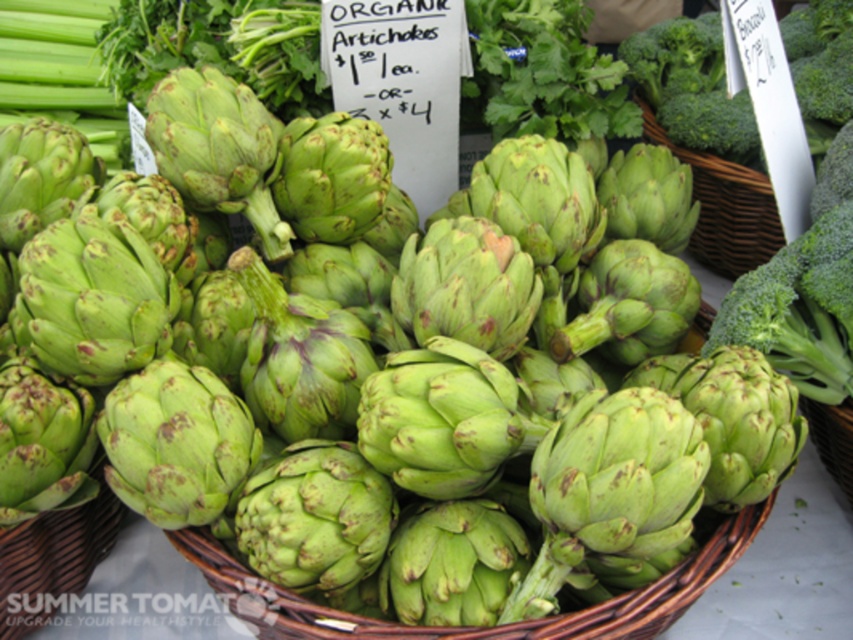
Question: Can you confirm if green wicker basket at center is positioned above woven brown basket at right?

Choices:
 (A) yes
 (B) no

Answer: (B)

Question: Can you confirm if green wicker basket at center is positioned to the left of woven brown basket at right?

Choices:
 (A) no
 (B) yes

Answer: (B)

Question: Which point appears closest to the camera in this image?

Choices:
 (A) (706, 157)
 (B) (236, 561)

Answer: (B)

Question: Is green wicker basket at center wider than woven brown basket at right?

Choices:
 (A) no
 (B) yes

Answer: (B)